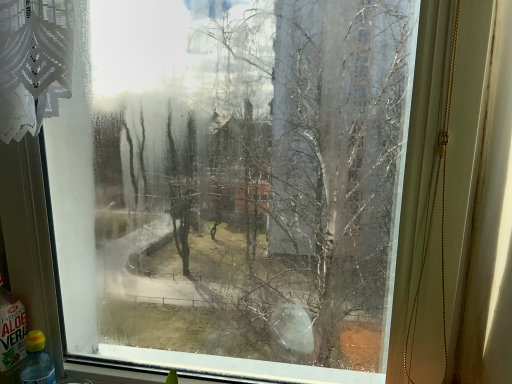
Question: Is translucent plastic bottle at lower left, marked as the second bottle in a left-to-right arrangement, in front of or behind translucent plastic bottle at lower left, which ranks as the second bottle in right-to-left order, in the image?

Choices:
 (A) front
 (B) behind

Answer: (B)

Question: Looking at their shapes, would you say translucent plastic bottle at lower left, marked as the second bottle in a left-to-right arrangement, is wider or thinner than translucent plastic bottle at lower left, which is counted as the 1th bottle, starting from the left?

Choices:
 (A) wide
 (B) thin

Answer: (B)

Question: Is translucent plastic bottle at lower left, marked as the second bottle in a left-to-right arrangement, inside or outside of translucent plastic bottle at lower left, which ranks as the second bottle in right-to-left order?

Choices:
 (A) inside
 (B) outside

Answer: (B)

Question: From a real-world perspective, is translucent plastic bottle at lower left, which is counted as the 1th bottle, starting from the left, physically located above or below translucent plastic bottle at lower left, the 1th bottle when ordered from right to left?

Choices:
 (A) below
 (B) above

Answer: (B)

Question: Is point (14, 372) positioned closer to the camera than point (42, 365)?

Choices:
 (A) farther
 (B) closer

Answer: (A)

Question: Based on their sizes in the image, would you say translucent plastic bottle at lower left, which is counted as the 1th bottle, starting from the left, is bigger or smaller than translucent plastic bottle at lower left, marked as the second bottle in a left-to-right arrangement?

Choices:
 (A) small
 (B) big

Answer: (B)

Question: Looking at their shapes, would you say translucent plastic bottle at lower left, which ranks as the second bottle in right-to-left order, is wider or thinner than translucent plastic bottle at lower left, marked as the second bottle in a left-to-right arrangement?

Choices:
 (A) wide
 (B) thin

Answer: (A)